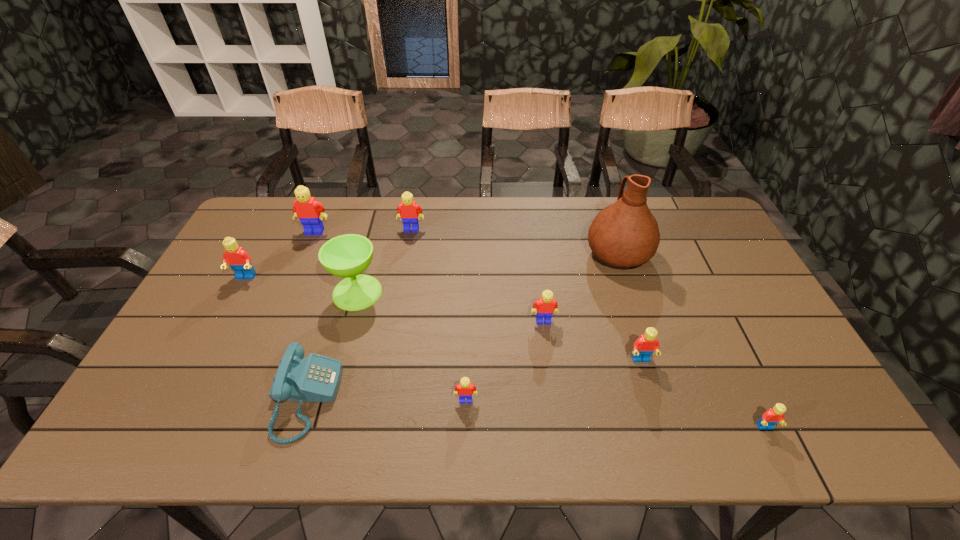
Image resolution: width=960 pixels, height=540 pixels. What are the coordinates of `free space located on the front-facing side of the biggest yellow Lego` in the screenshot? It's located at (305, 255).

The height and width of the screenshot is (540, 960). In order to click on free spot located on the left of the wineglass in this screenshot , I will do `click(202, 292)`.

This screenshot has height=540, width=960. What are the coordinates of `free space located on the face of the biggest red Lego` in the screenshot? It's located at (227, 313).

Where is `vacant position located on the front-facing side of the third yellow Lego from right to left`? Image resolution: width=960 pixels, height=540 pixels. vacant position located on the front-facing side of the third yellow Lego from right to left is located at coordinates (408, 252).

In order to click on blank space located on the front-facing side of the fifth nearest object in this screenshot , I will do `click(549, 364)`.

Locate an element on the screen. The height and width of the screenshot is (540, 960). vacant position located 0.110m on the face of the second smallest red Lego is located at coordinates (655, 406).

Locate an element on the screen. vacant area located on the front-facing side of the smallest yellow Lego is located at coordinates (465, 436).

This screenshot has height=540, width=960. Find the location of `vacant space located on the dial of the telephone`. vacant space located on the dial of the telephone is located at coordinates (441, 399).

You are a GUI agent. You are given a task and a screenshot of the screen. Output one action in this format:
    pyautogui.click(x=<x>, y=<y>)
    Task: Click on the pitcher that is at the far edge
    
    Given the screenshot: What is the action you would take?
    pyautogui.click(x=625, y=234)

Locate an element on the screen. Lego situated at the near edge is located at coordinates [774, 415].